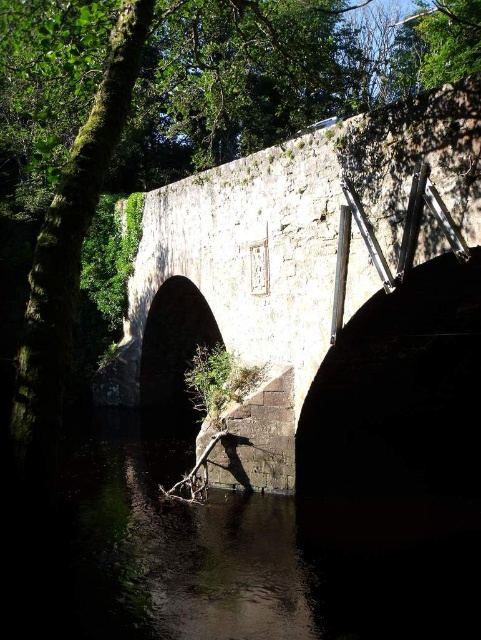
You are standing at the origin point of the image coordinate system. You want to move to the dark stone water at lower center. What are the coordinates you need to move to?

The coordinates you need to move to are 0.867 on the x axis and 0.459 on the y axis.